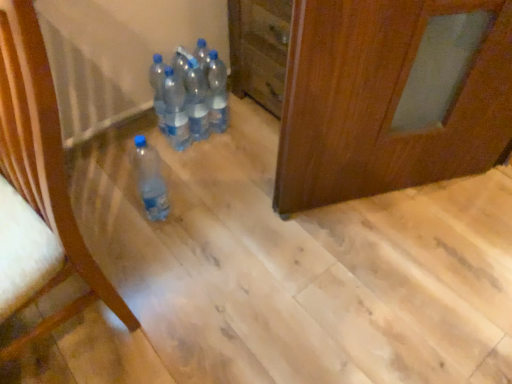
Find the location of a particular element. The width and height of the screenshot is (512, 384). spots to the right of transparent plastic bottles at center, the 5th bottle when ordered from right to left is located at coordinates (217, 143).